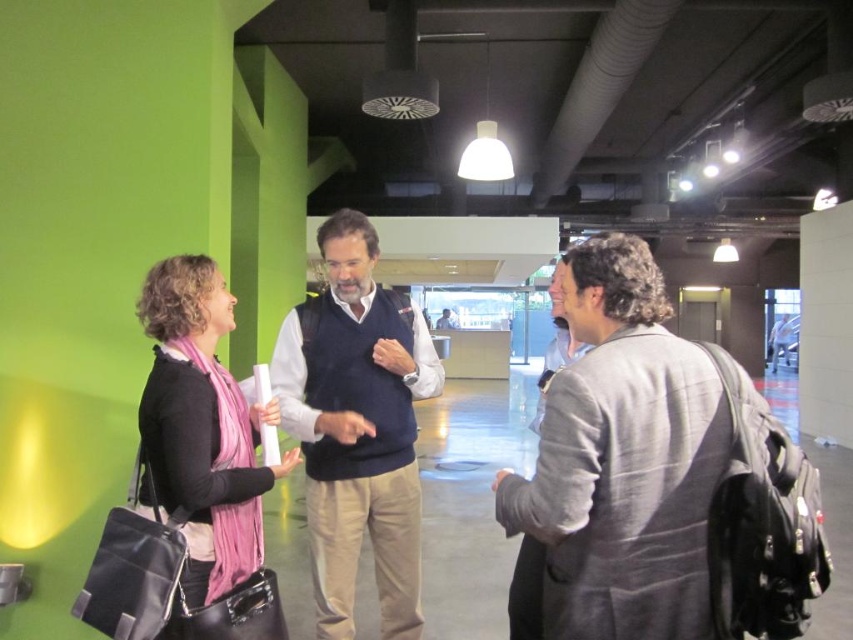
You are a photographer setting up a shoot in the room. You need to position a light source so it illuminates both the dark blue sweater vest at center and the pink scarf at left without causing harsh shadows. Given their positions, where should you place the light source relative to the two objects?

The dark blue sweater vest at center is below the pink scarf at left. To avoid harsh shadows, the light source should be placed above both the dark blue sweater vest at center and the pink scarf at left so that it illuminates them evenly from above.

You are a tailor who needs to determine which item requires more fabric for alterations. Based on the scene, which item is wider, the gray woolen blazer at right or the pink scarf at left?

The gray woolen blazer at right is wider than the pink scarf at left according to the description.